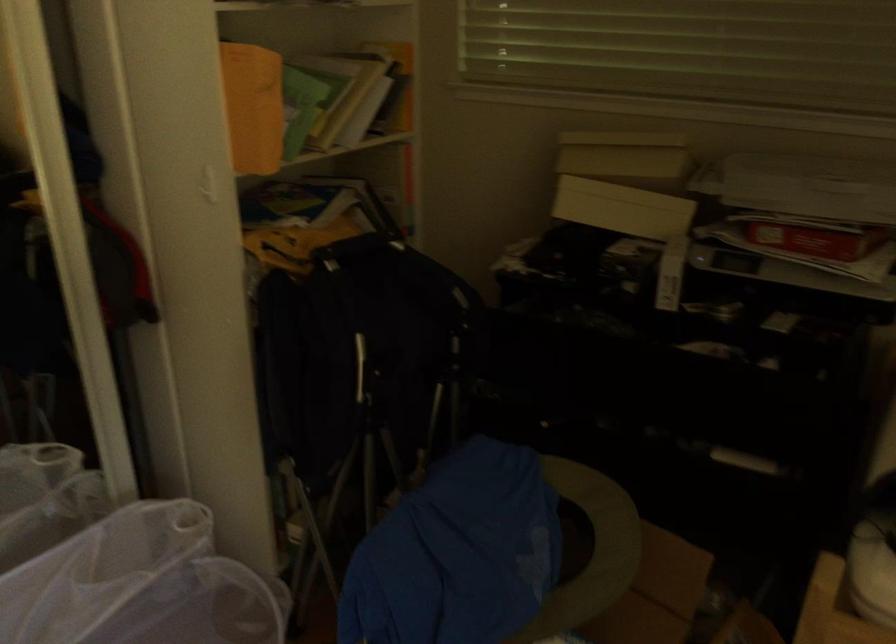
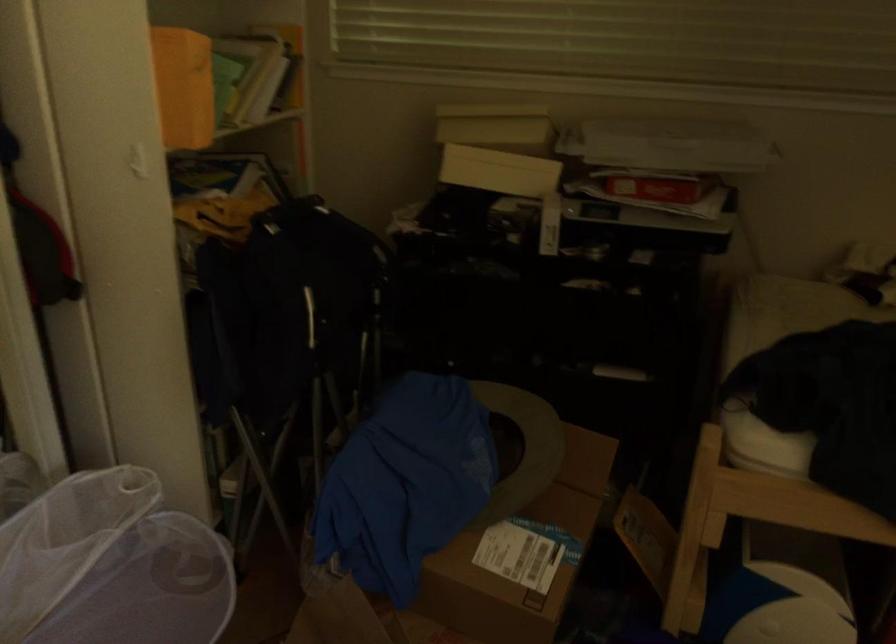
Question: Based on the continuous images, in which direction is the camera rotating? Reply with the corresponding letter.

Choices:
 (A) Left
 (B) Right
 (C) Up
 (D) Down

Answer: (B)